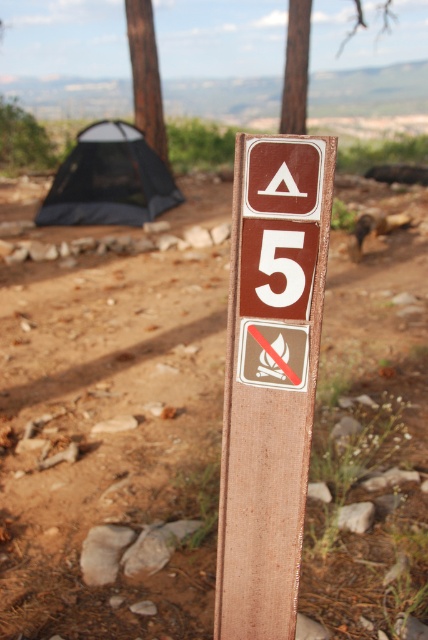
You are a hiker planning to set up camp near the brown wooden sign at center. You see the brown dirt track at center nearby. Which direction should you go to follow the track away from the sign?

The brown dirt track at center is below the brown wooden sign at center, so to follow the track away from the sign, you should go downward from the sign.

You are planning to walk from the brown rough wood tree at upper left to the brown dirt track at center. Based on the scene, which direction should you head to reach the track?

The brown dirt track at center is in front of the brown rough wood tree at upper left, so you should head forward towards the track to reach it.

You are a hiker carrying a backpack that is 1.5 meters wide. You want to walk from the brown dirt track at center to the brown wooden sign at center. Can your backpack fit through the space between them?

The distance between the brown dirt track at center and the brown wooden sign at center is 1.85 meters. Since your backpack is 1.5 meters wide, it can fit through the space as the distance is greater than the backpack width.